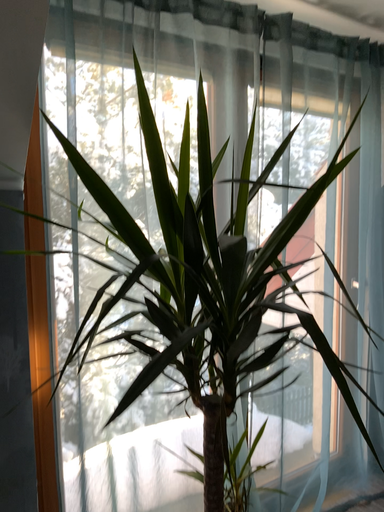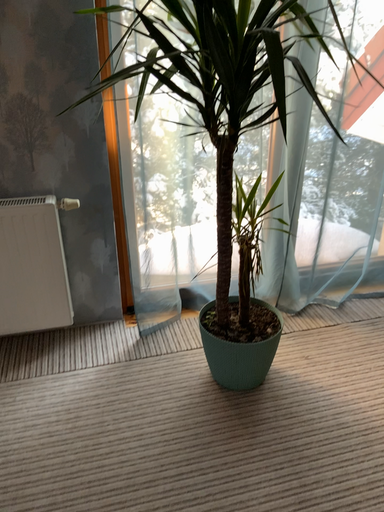
Question: How did the camera likely rotate when shooting the video?

Choices:
 (A) rotated downward
 (B) rotated upward

Answer: (A)